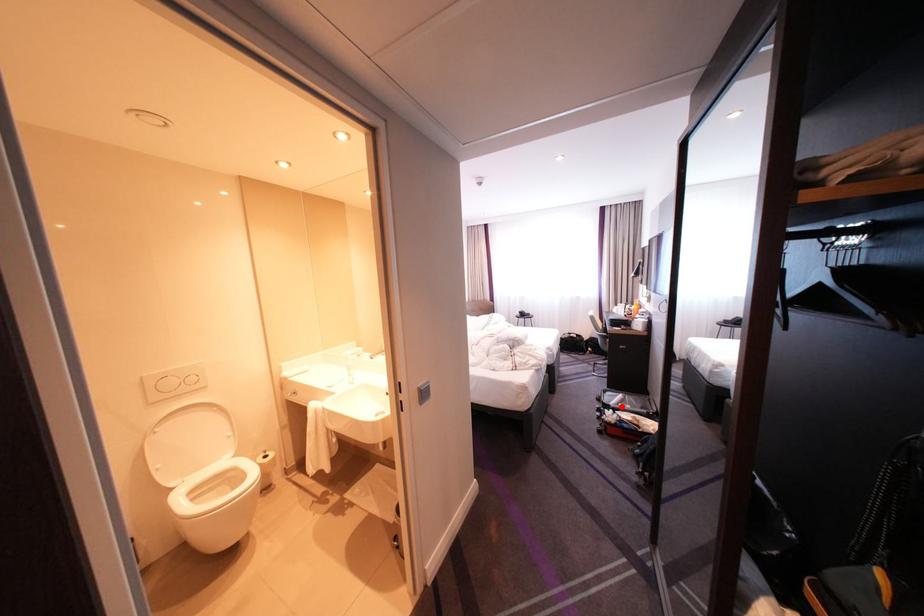
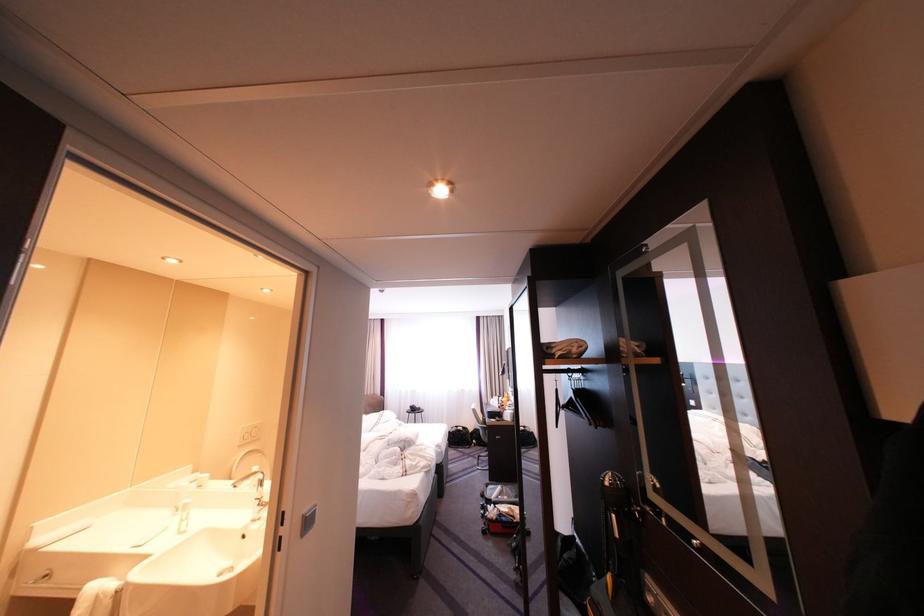
Question: I am providing you with two images of the same scene from different viewpoints. Given a red point in image1, look at the same physical point in image2. Is it:

Choices:
 (A) Closer to the viewpoint
 (B) Farther from the viewpoint

Answer: (B)